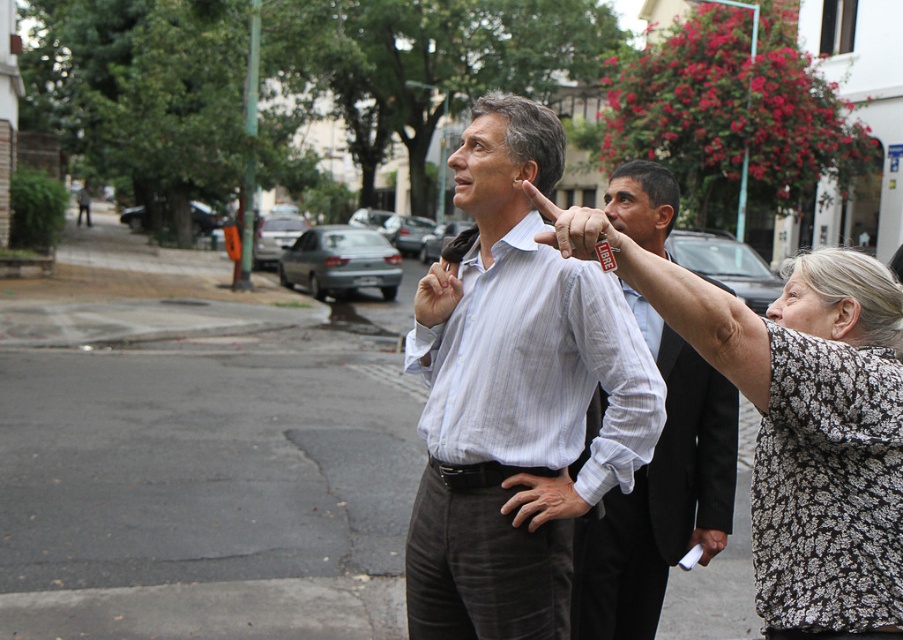
Question: Which point is closer to the camera?

Choices:
 (A) white striped dress shirt at center
 (B) floral-patterned blouse at center
 (C) black floral-patterned blouse at upper right
 (D) matte plastic finger at center

Answer: (D)

Question: Which point is closer to the camera?

Choices:
 (A) white striped dress shirt at center
 (B) matte plastic finger at center
 (C) floral-patterned blouse at center

Answer: (B)

Question: Which point is closer to the camera?

Choices:
 (A) (557, 358)
 (B) (891, 372)

Answer: (B)

Question: Can you confirm if black floral-patterned blouse at upper right is thinner than white striped dress shirt at center?

Choices:
 (A) yes
 (B) no

Answer: (A)

Question: Does black floral-patterned blouse at upper right have a larger size compared to matte plastic finger at center?

Choices:
 (A) yes
 (B) no

Answer: (A)

Question: Can you confirm if floral-patterned blouse at center is positioned above black floral-patterned blouse at upper right?

Choices:
 (A) yes
 (B) no

Answer: (B)